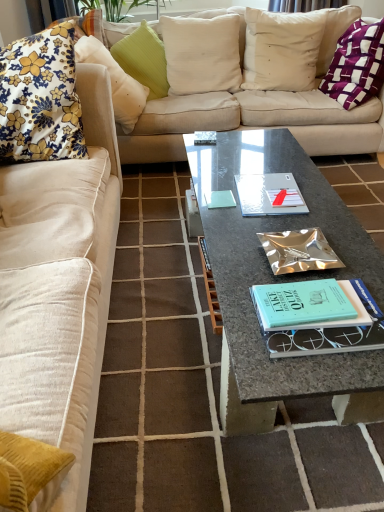
Question: Is white cotton pillow at upper center, marked as the second pillow in a right-to-left arrangement, oriented towards white linen pillow at upper center, which is the third pillow in right-to-left order?

Choices:
 (A) no
 (B) yes

Answer: (A)

Question: Considering the relative sizes of white cotton pillow at upper center, the fifth pillow in the left-to-right sequence, and white linen pillow at upper center, which is the 4th pillow in left-to-right order, in the image provided, is white cotton pillow at upper center, the fifth pillow in the left-to-right sequence, wider than white linen pillow at upper center, which is the 4th pillow in left-to-right order,?

Choices:
 (A) yes
 (B) no

Answer: (B)

Question: Is white cotton pillow at upper center, marked as the second pillow in a right-to-left arrangement, next to white linen pillow at upper center, which is the third pillow in right-to-left order, and touching it?

Choices:
 (A) yes
 (B) no

Answer: (B)

Question: Is white cotton pillow at upper center, the fifth pillow in the left-to-right sequence, further to the viewer compared to white linen pillow at upper center, which is the 4th pillow in left-to-right order?

Choices:
 (A) yes
 (B) no

Answer: (B)

Question: Is white linen pillow at upper center, which is the third pillow in right-to-left order, inside white cotton pillow at upper center, the fifth pillow in the left-to-right sequence?

Choices:
 (A) yes
 (B) no

Answer: (B)

Question: From the image's perspective, relative to green textured pillow at upper center, the fourth pillow in the right-to-left sequence, is metallic silver book at center above or below?

Choices:
 (A) below
 (B) above

Answer: (A)

Question: Looking at their shapes, would you say metallic silver book at center is wider or thinner than green textured pillow at upper center, the fourth pillow in the right-to-left sequence?

Choices:
 (A) wide
 (B) thin

Answer: (B)

Question: Choose the correct answer: Is metallic silver book at center inside green textured pillow at upper center, the fourth pillow in the right-to-left sequence, or outside it?

Choices:
 (A) outside
 (B) inside

Answer: (A)

Question: Is metallic silver book at center taller or shorter than green textured pillow at upper center, the fourth pillow in the right-to-left sequence?

Choices:
 (A) short
 (B) tall

Answer: (A)

Question: Considering the positions of granite coffee table at center and floral fabric cushion at left, which is the sixth pillow in right-to-left order, in the image, is granite coffee table at center taller or shorter than floral fabric cushion at left, which is the sixth pillow in right-to-left order,?

Choices:
 (A) short
 (B) tall

Answer: (A)

Question: Is point (213, 157) positioned closer to the camera than point (49, 62)?

Choices:
 (A) farther
 (B) closer

Answer: (A)

Question: From the image's perspective, is granite coffee table at center located above or below floral fabric cushion at left, arranged as the 1th pillow when viewed from the left?

Choices:
 (A) above
 (B) below

Answer: (B)

Question: Is granite coffee table at center to the left or to the right of floral fabric cushion at left, which is the sixth pillow in right-to-left order, in the image?

Choices:
 (A) left
 (B) right

Answer: (B)

Question: Considering the positions of point (357, 36) and point (4, 84), is point (357, 36) closer or farther from the camera than point (4, 84)?

Choices:
 (A) farther
 (B) closer

Answer: (A)

Question: From their relative heights in the image, would you say purple woven pillow at upper right, arranged as the 6th pillow when viewed from the left, is taller or shorter than floral fabric cushion at left, which is the sixth pillow in right-to-left order?

Choices:
 (A) short
 (B) tall

Answer: (A)